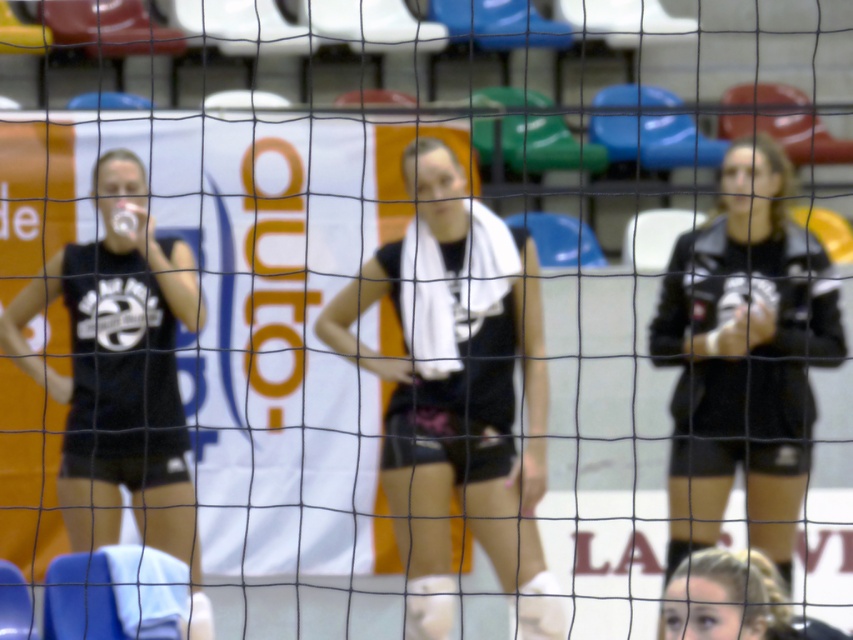
You are a photographer standing at the center of the volleyball court. You want to take a photo that includes both the point at position (430,224) and the point at (685,289). Which point is closer to your camera lens?

Point at position (430,224) is closer to the camera lens than the point at (685,289).

Consider the image. You are a photographer standing behind the volleyball net. You need to take a photo of both the black matte tank top at center and the black matte jacket at right. Which person should you position closer to the camera to ensure both are fully visible in the frame?

The black matte tank top at center is much taller than the black matte jacket at right, so positioning the black matte jacket at right closer to the camera will help balance their sizes in the photo.

You are a photographer positioned at the volleyball net. You notice the black matte jacket at right and the black matte tank top at left. Which of these two items is closer to your camera lens?

The black matte jacket at right is closer to the camera lens because it is further to the viewer than the black matte tank top at left.